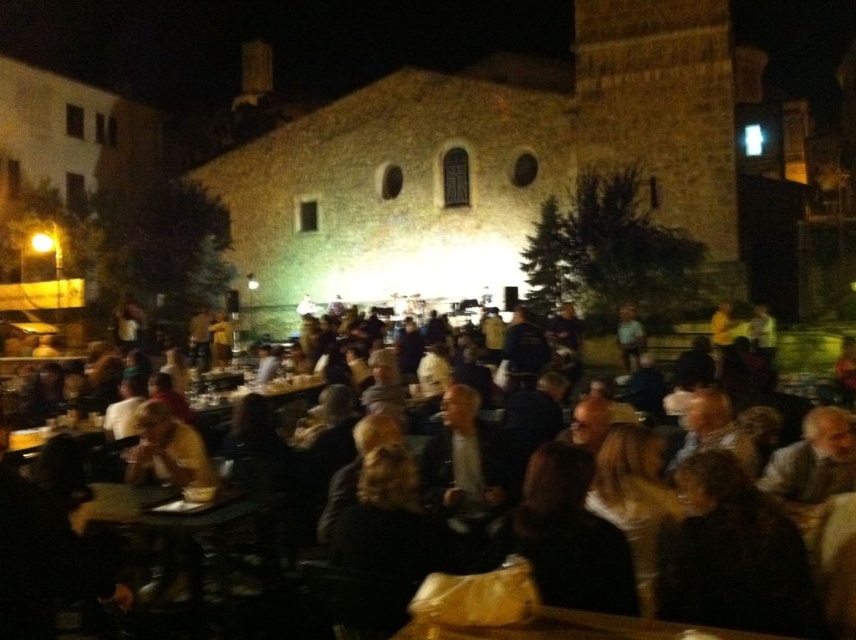
You are at a social event in the courtyard and want to sit down. You see the dark brown leather chairs at center and the wooden table at lower left. Which object is located to the right of the other?

The dark brown leather chairs at center is positioned on the right side of wooden table at lower left, so the dark brown leather chairs at center are to the right of the wooden table at lower left.